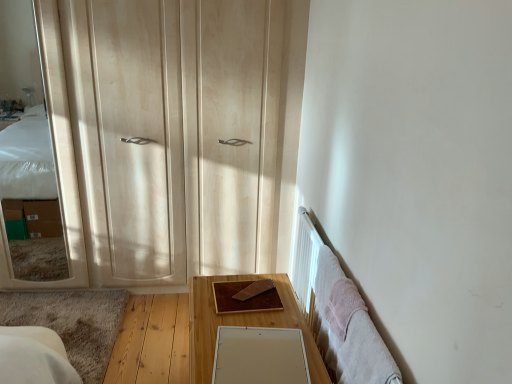
At what (x,y) coordinates should I click in order to perform the action: click on vacant space in front of matte wooden mirror at left, placed as the first mirror when sorted from top to bottom. Please return your answer as a coordinate pair (x, y). The image size is (512, 384). Looking at the image, I should click on (33, 313).